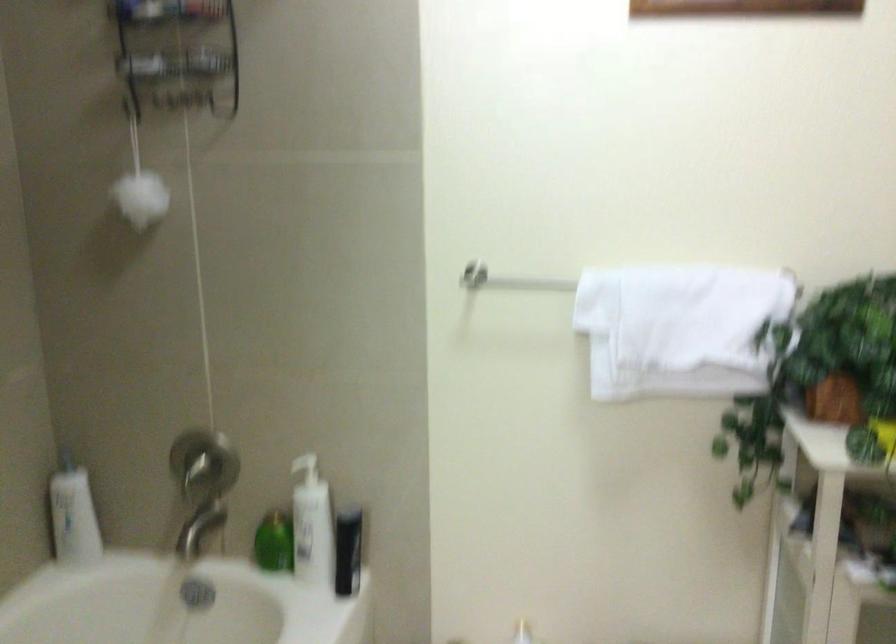
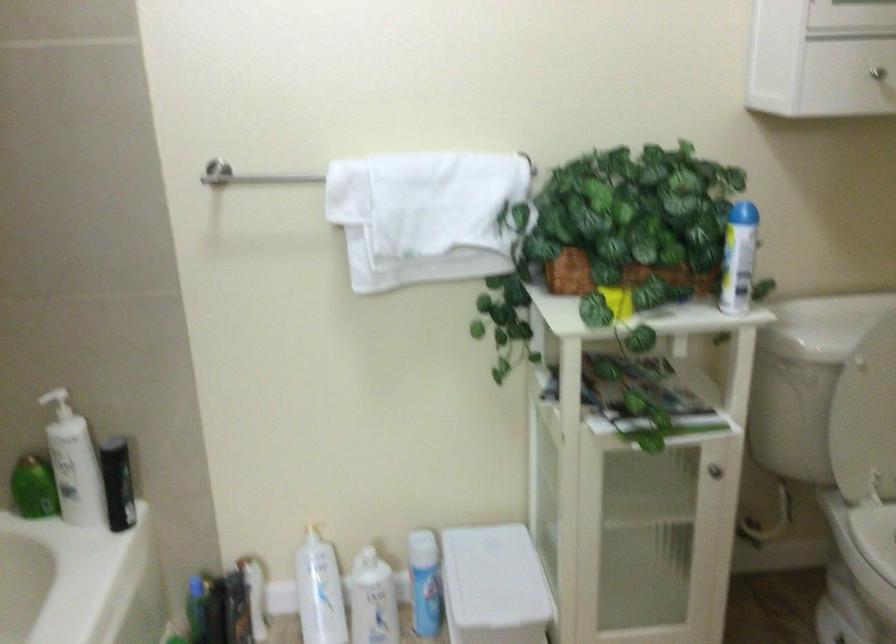
Find the pixel in the second image that matches point (271, 545) in the first image.

(33, 488)